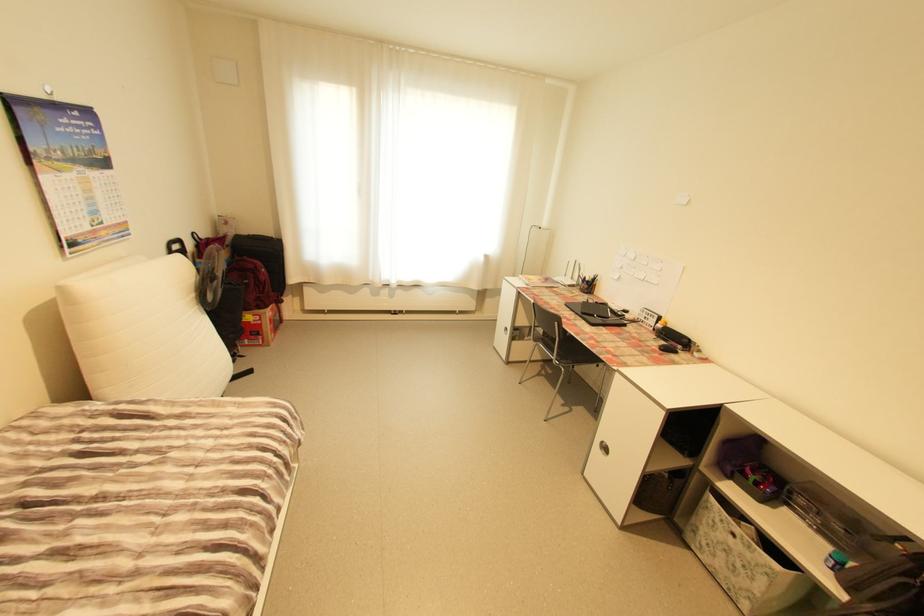
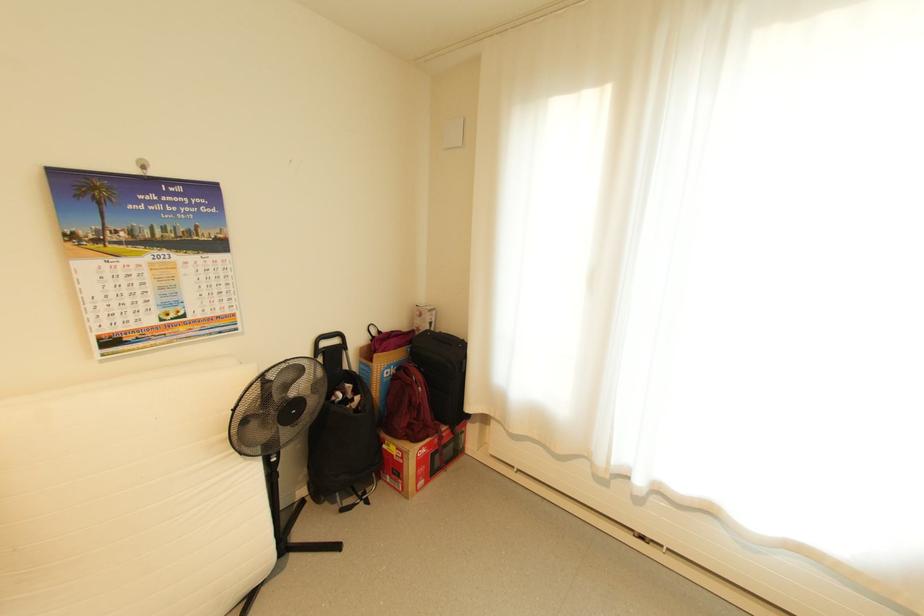
Find the pixel in the second image that matches point (261, 315) in the first image.

(404, 448)